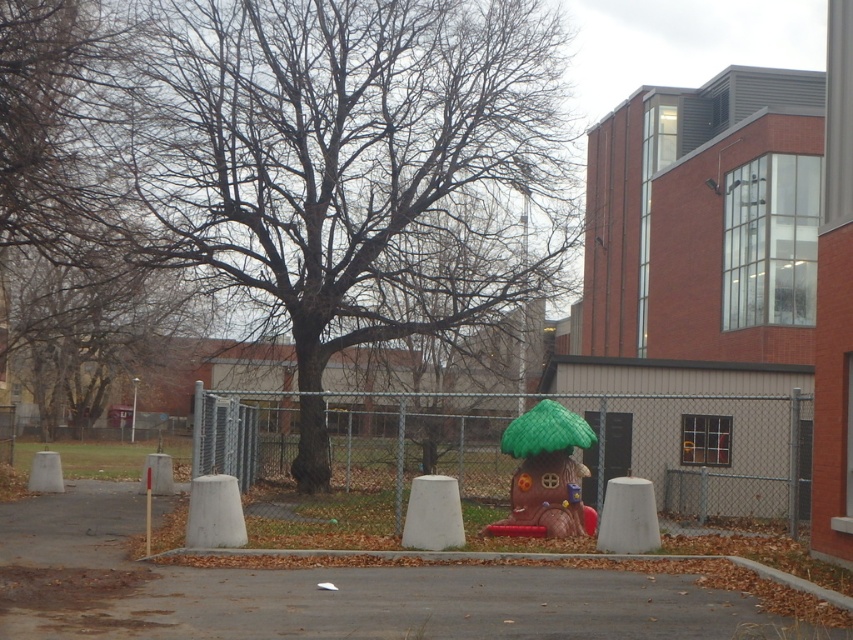
Which is below, gray asphalt pavement at center or gray chain-link fence at center?

Positioned lower is gray asphalt pavement at center.

Is point (438, 628) positioned behind point (613, 397)?

No, it is not.

Which is behind, point (543, 611) or point (502, 412)?

Positioned behind is point (502, 412).

The height and width of the screenshot is (640, 853). What are the coordinates of `gray asphalt pavement at center` in the screenshot? It's located at (316, 589).